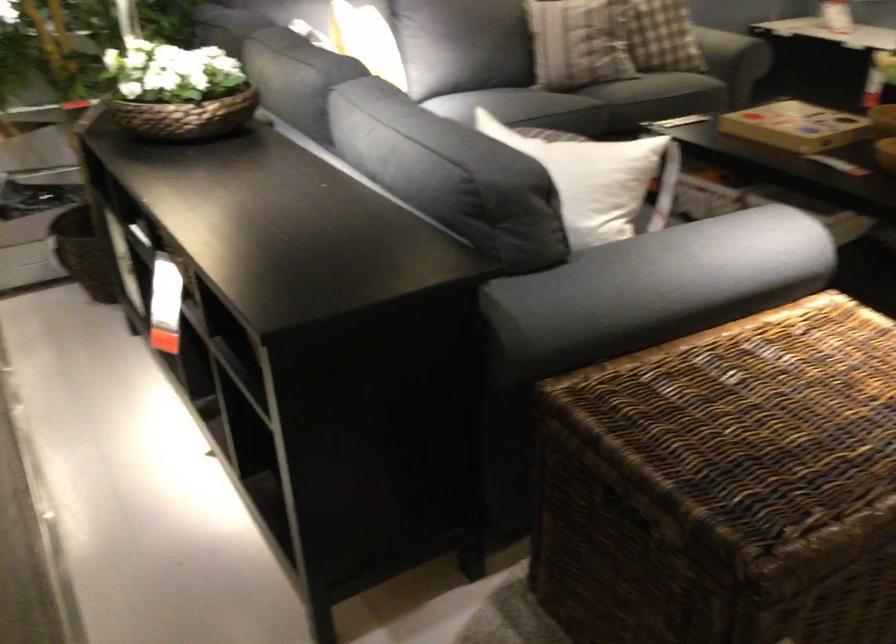
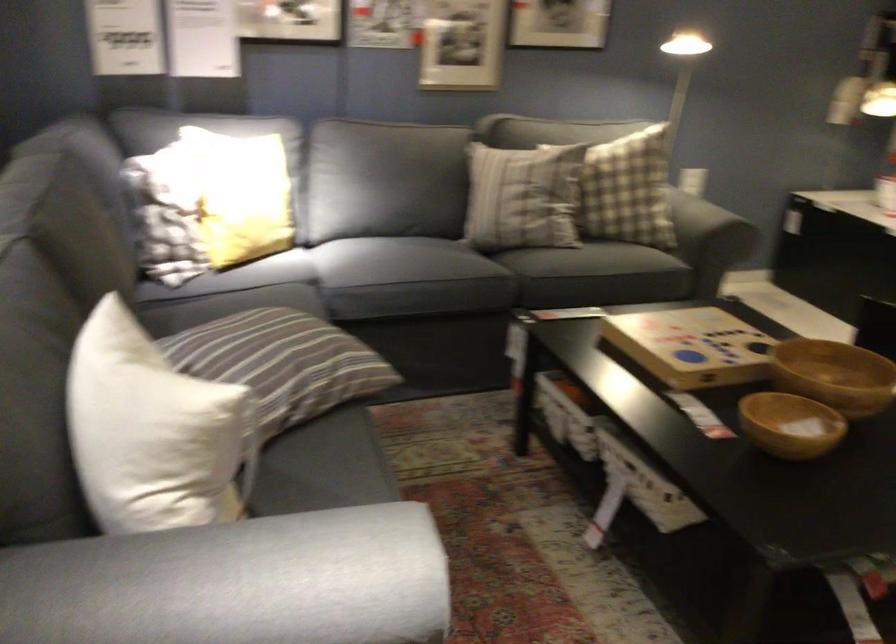
Consider the image. Which direction would the cameraman need to move to produce the second image?

The cameraman walked toward right, forward.